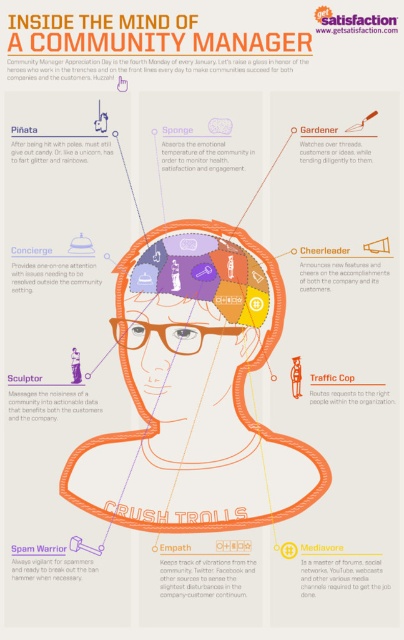
Is matte purple brain at center behind orange matte head at center?

No.

Who is more forward, (231, 525) or (176, 294)?

Point (231, 525)

This screenshot has width=404, height=640. I want to click on matte purple brain at center, so click(x=195, y=392).